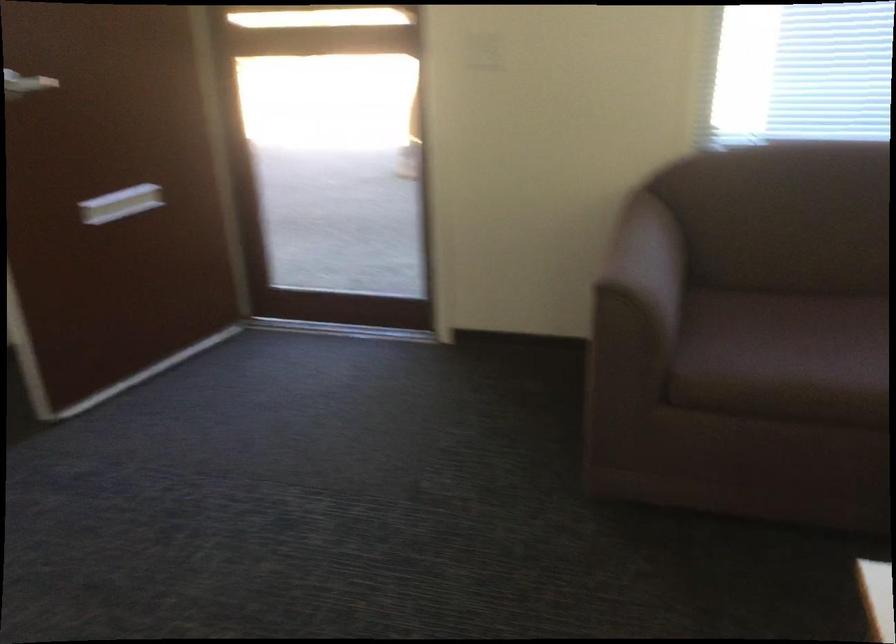
Where would you resting arm the sofa armrest? Please return your answer as a coordinate pair (x, y).

(648, 261)